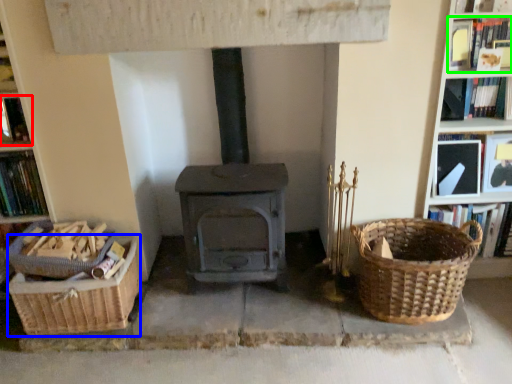
Question: Which object is the farthest from book (highlighted by a red box)? Choose among these: basket container (highlighted by a blue box) or book (highlighted by a green box).

Choices:
 (A) basket container
 (B) book

Answer: (B)